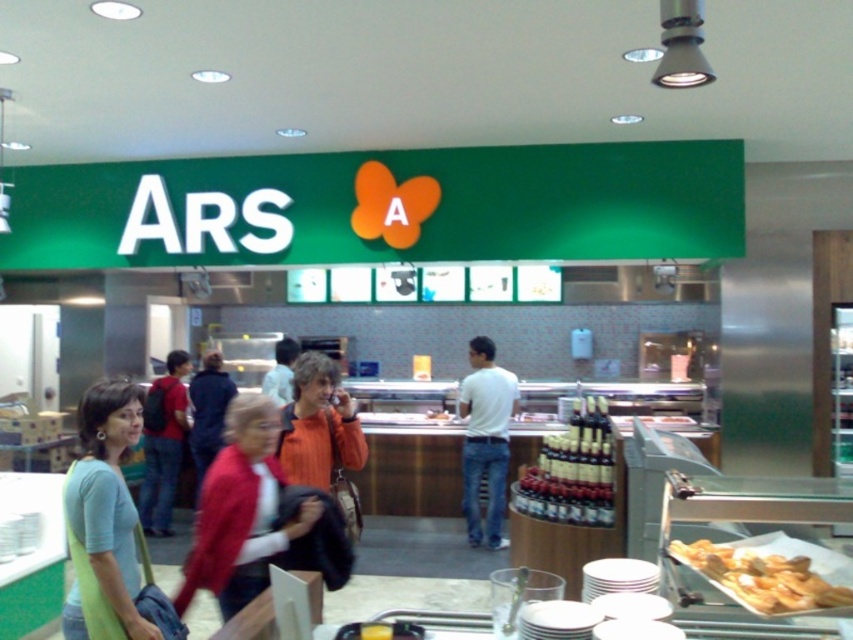
Is golden crispy pastry at lower right further to the viewer compared to jeans at center?

No, it is in front of jeans at center.

Which is in front, point (833, 600) or point (148, 518)?

Positioned in front is point (833, 600).

Where is `golden crispy pastry at lower right`? golden crispy pastry at lower right is located at coordinates (762, 577).

This screenshot has height=640, width=853. Describe the element at coordinates (241, 512) in the screenshot. I see `red sweater at center` at that location.

Between red sweater at center and light blue fabric shirt at center, which one appears on the right side from the viewer's perspective?

From the viewer's perspective, red sweater at center appears more on the right side.

The image size is (853, 640). What do you see at coordinates (241, 512) in the screenshot?
I see `red sweater at center` at bounding box center [241, 512].

You are a GUI agent. You are given a task and a screenshot of the screen. Output one action in this format:
    pyautogui.click(x=<x>, y=<y>)
    Task: Click on the red sweater at center
    The width and height of the screenshot is (853, 640).
    Given the screenshot: What is the action you would take?
    (241, 512)

Between shiny glass bottles at center and jeans at center, which one appears on the left side from the viewer's perspective?

From the viewer's perspective, jeans at center appears more on the left side.

Is point (558, 518) farther from viewer compared to point (167, 429)?

No, it is in front of (167, 429).

Measure the distance between point (573, 508) and camera.

The distance of point (573, 508) from camera is 13.40 feet.

You are a GUI agent. You are given a task and a screenshot of the screen. Output one action in this format:
    pyautogui.click(x=<x>, y=<y>)
    Task: Click on the shiny glass bottles at center
    
    Given the screenshot: What is the action you would take?
    pyautogui.click(x=572, y=470)